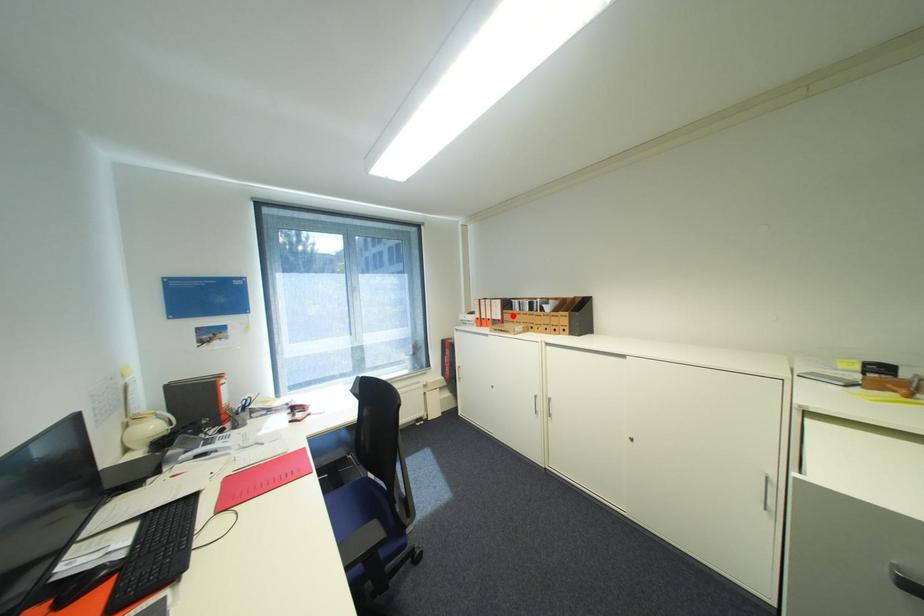
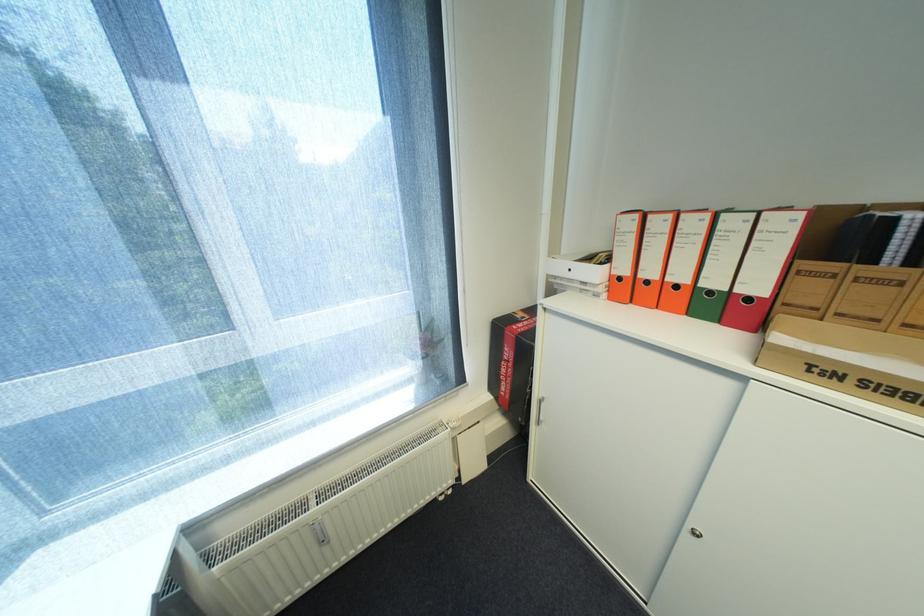
The point at the highlighted location is marked in the first image. Where is the corresponding point in the second image?

(806, 282)